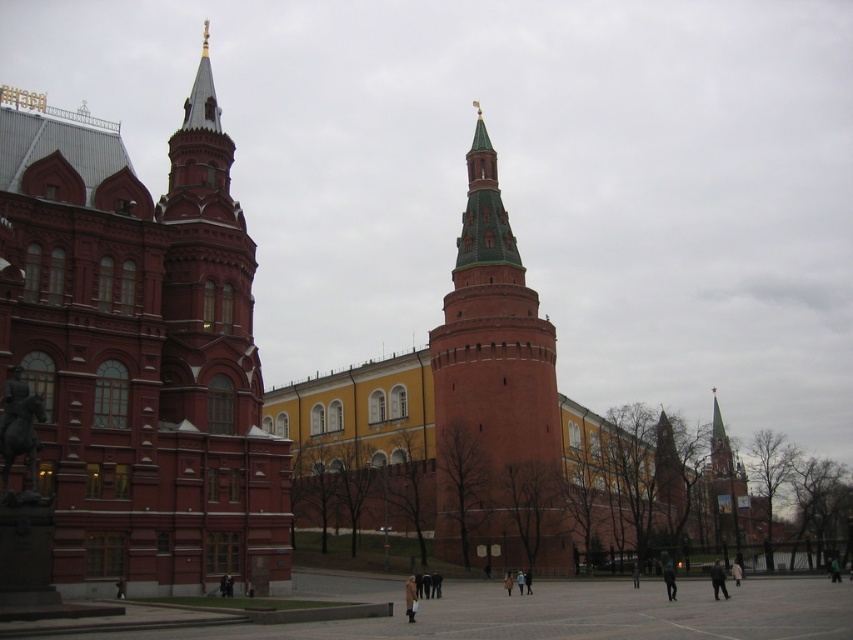
You are standing at the point with coordinates point (x=106, y=548) and want to walk to the point with coordinates point (x=532, y=300). Will you pass in front of or behind the large red brick building during your journey?

You will pass in front of the large red brick building because point (x=106, y=548) is in front of point (x=532, y=300).

You are standing in the plaza in front of the smooth brick church at left. You want to walk to the nearest tower with a pointed spire. Which direction should you walk relative to the church?

The smooth brick church at left is located at point [138,353]. Since the towers with pointed spires are part of the fortified area, which is likely surrounding the buildings, you should walk towards the direction of the towers. However, without specific coordinates for the towers, the best guess is to walk towards the center or towards the adjacent yellow building where the towers might be located.